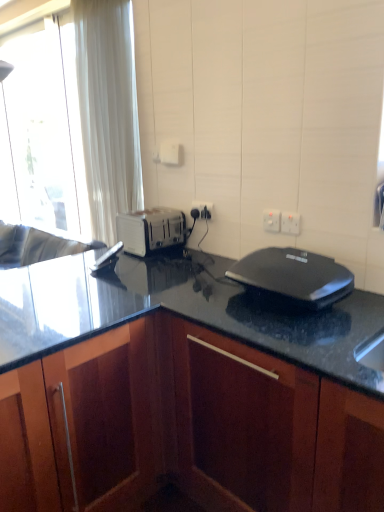
The width and height of the screenshot is (384, 512). I want to click on vacant space situated above black plastic sandwich maker at center (from a real-world perspective), so click(288, 256).